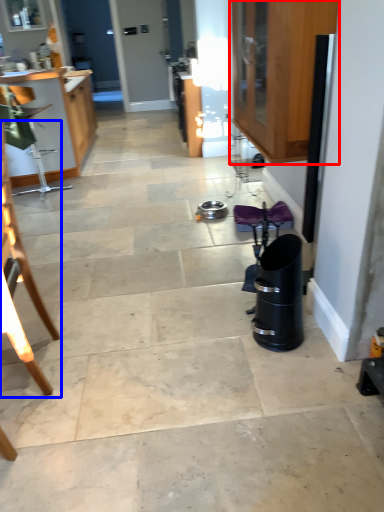
Question: Which point is further to the camera, cabinetry (highlighted by a red box) or chair (highlighted by a blue box)?

Choices:
 (A) cabinetry
 (B) chair

Answer: (A)